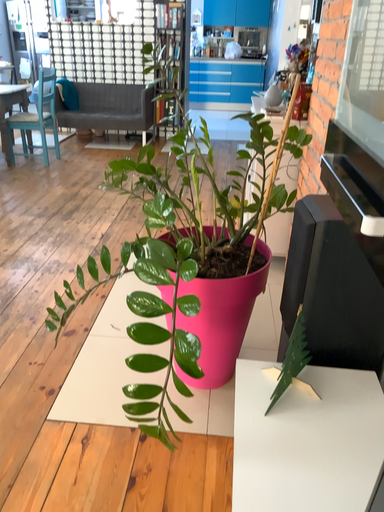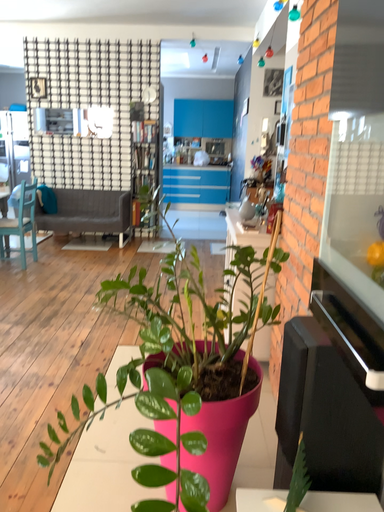
Question: How did the camera likely rotate when shooting the video?

Choices:
 (A) rotated upward
 (B) rotated downward

Answer: (A)